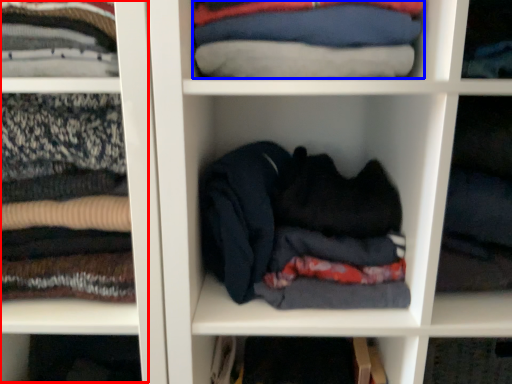
Question: Which object is further to the camera taking this photo, cabinet (highlighted by a red box) or clothing (highlighted by a blue box)?

Choices:
 (A) cabinet
 (B) clothing

Answer: (B)